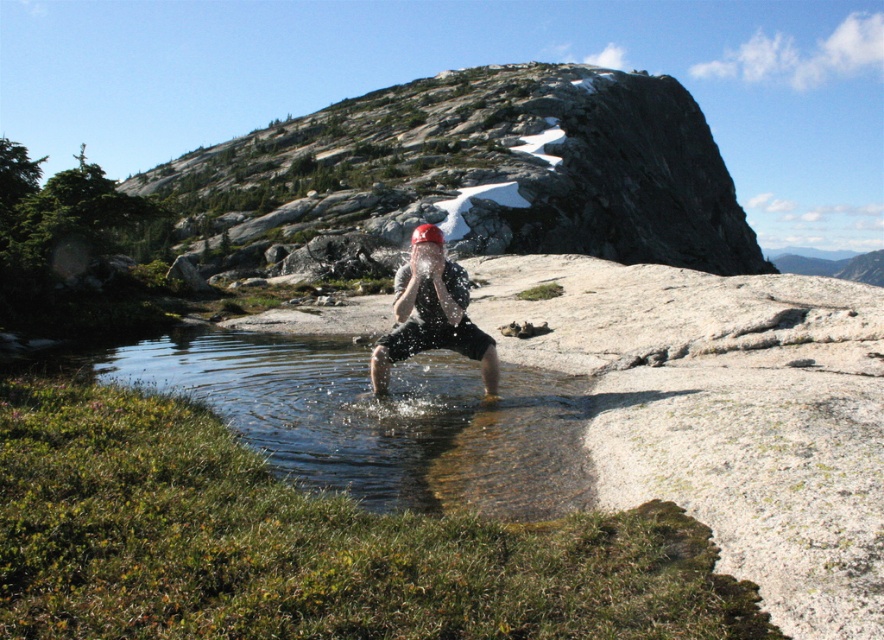
Question: Which object appears closest to the camera in this image?

Choices:
 (A) clear water at center
 (B) matte black helmet at center

Answer: (A)

Question: Which point is closer to the camera?

Choices:
 (A) matte black helmet at center
 (B) clear water at center

Answer: (B)

Question: Among these objects, which one is nearest to the camera?

Choices:
 (A) clear water at center
 (B) matte black helmet at center

Answer: (A)

Question: Does clear water at center have a lesser width compared to matte black helmet at center?

Choices:
 (A) no
 (B) yes

Answer: (A)

Question: In this image, where is clear water at center located relative to matte black helmet at center?

Choices:
 (A) right
 (B) left

Answer: (B)

Question: Does clear water at center appear under matte black helmet at center?

Choices:
 (A) no
 (B) yes

Answer: (B)